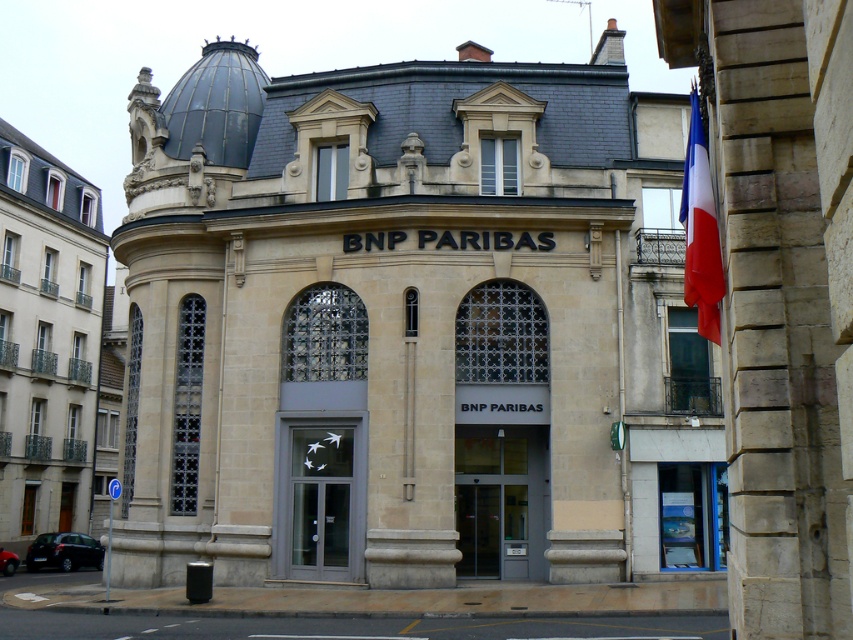
Question: Which object is the closest to the transparent glass door at center?

Choices:
 (A) dark gray metallic car at lower left
 (B) matte gray door at center

Answer: (B)

Question: Among these points, which one is nearest to the camera?

Choices:
 (A) (16, 564)
 (B) (312, 552)
 (C) (467, 456)

Answer: (B)

Question: Among these points, which one is farthest from the camera?

Choices:
 (A) (503, 435)
 (B) (311, 568)

Answer: (A)

Question: Is transparent glass door at center thinner than red fabric flag at upper right?

Choices:
 (A) no
 (B) yes

Answer: (B)

Question: Does transparent glass door at center have a smaller size compared to metallic red car at lower left?

Choices:
 (A) no
 (B) yes

Answer: (B)

Question: Is dark gray metallic car at lower left below metallic red car at lower left?

Choices:
 (A) no
 (B) yes

Answer: (B)